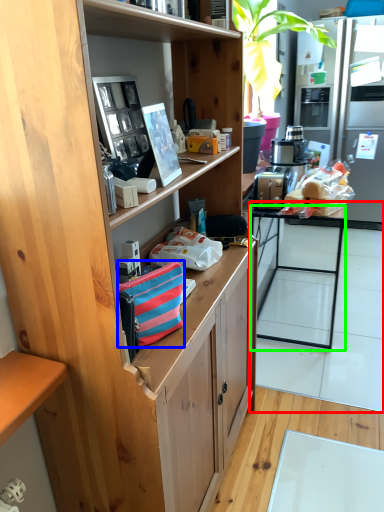
Question: Estimate the real-world distances between objects in this image. Which object is farther from table (highlighted by a red box), handbag (highlighted by a blue box) or desk (highlighted by a green box)?

Choices:
 (A) handbag
 (B) desk

Answer: (A)